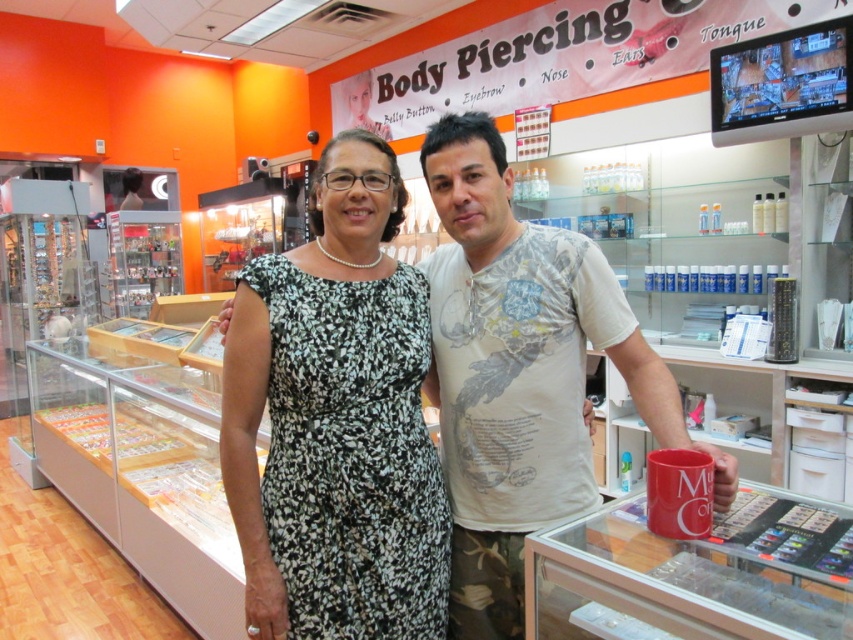
Question: Does black floral dress at center have a smaller size compared to white printed t-shirt at center?

Choices:
 (A) no
 (B) yes

Answer: (B)

Question: Which point is closer to the camera?

Choices:
 (A) black floral dress at center
 (B) white printed t-shirt at center

Answer: (B)

Question: Does black floral dress at center lie in front of white printed t-shirt at center?

Choices:
 (A) no
 (B) yes

Answer: (A)

Question: Can you confirm if black floral dress at center is bigger than white printed t-shirt at center?

Choices:
 (A) yes
 (B) no

Answer: (B)

Question: Among these objects, which one is nearest to the camera?

Choices:
 (A) black floral dress at center
 (B) white printed t-shirt at center

Answer: (B)